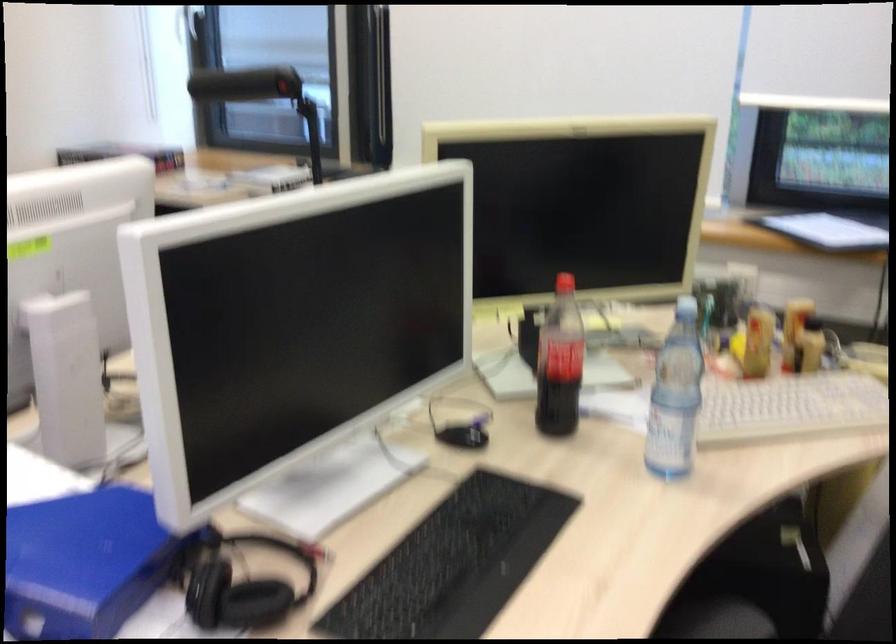
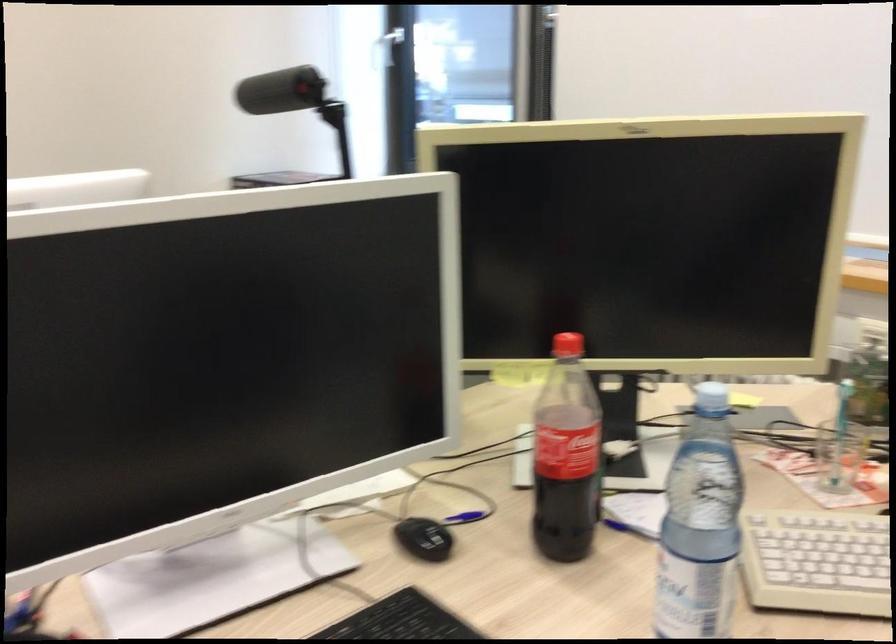
Where in the second image is the point corresponding to (x=696, y=348) from the first image?

(839, 456)